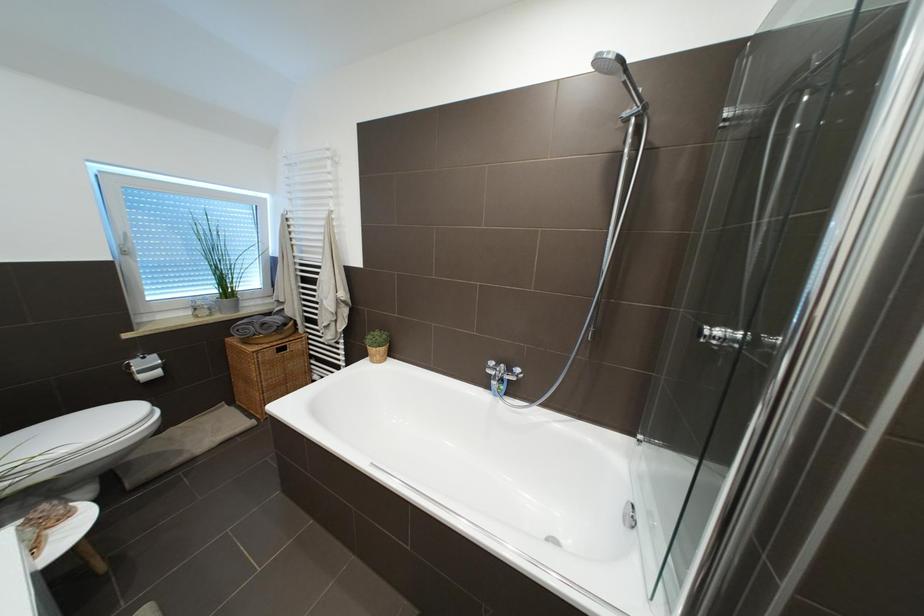
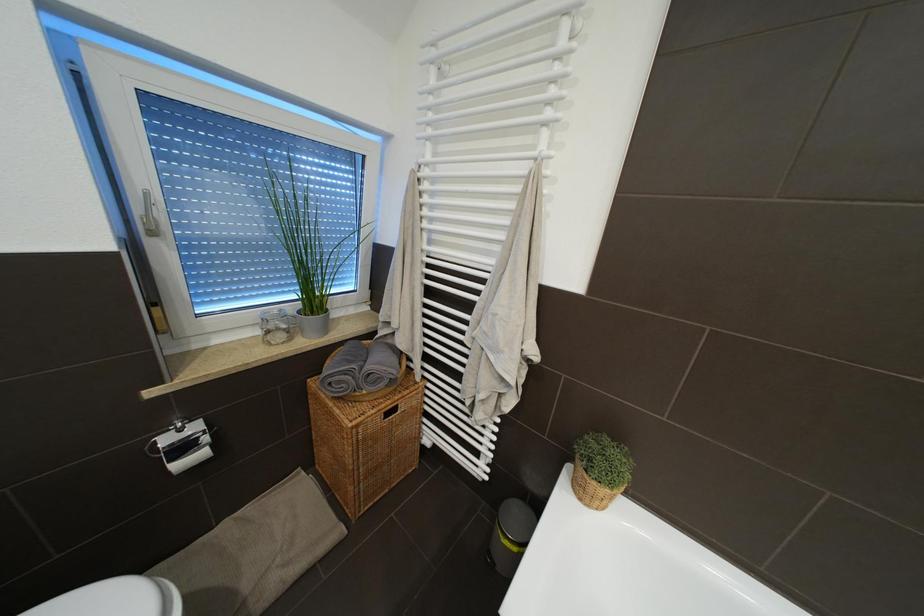
What movement of the cameraman would produce the second image?

The movement direction of the cameraman is left, forward.